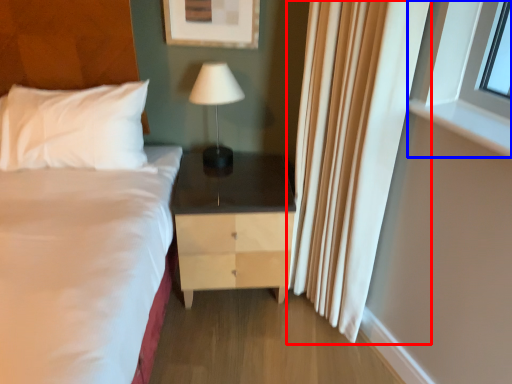
Question: Which of the following is the closest to the observer, curtain (highlighted by a red box) or window (highlighted by a blue box)?

Choices:
 (A) curtain
 (B) window

Answer: (A)